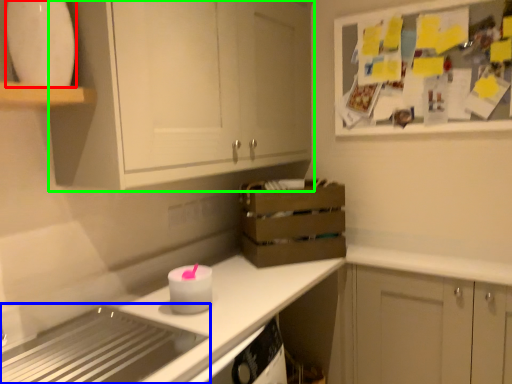
Question: Which is nearer to the appliance (highlighted by a red box)? appliance (highlighted by a blue box) or cabinetry (highlighted by a green box).

Choices:
 (A) appliance
 (B) cabinetry

Answer: (B)